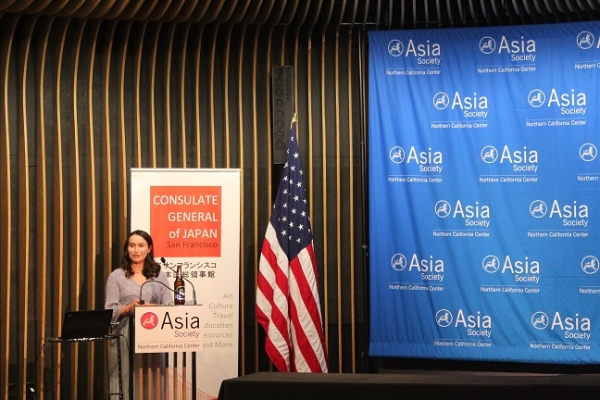
This screenshot has width=600, height=400. I want to click on speaker, so click(136, 277).